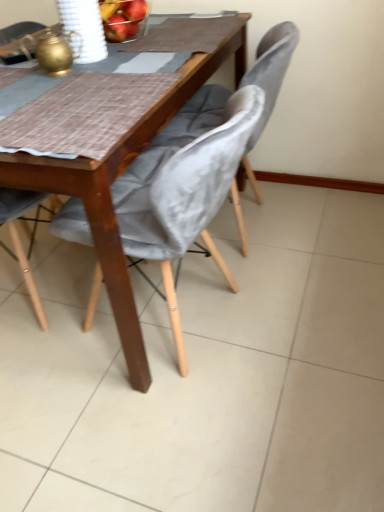
Question: Is velvet grey chair at center, the third chair from the left, further to the viewer compared to velvet grey chair at center, the second chair positioned from the left?

Choices:
 (A) yes
 (B) no

Answer: (A)

Question: Does velvet grey chair at center, the third chair from the left, appear on the left side of velvet grey chair at center, the second chair positioned from the left?

Choices:
 (A) no
 (B) yes

Answer: (A)

Question: Is velvet grey chair at center, the third chair from the left, positioned with its back to velvet grey chair at center, the second chair positioned from the left?

Choices:
 (A) yes
 (B) no

Answer: (B)

Question: Would you say velvet grey chair at center, the third chair from the left, contains velvet grey chair at center, which is the second chair in right-to-left order?

Choices:
 (A) no
 (B) yes

Answer: (A)

Question: Does velvet grey chair at center, the 1th chair in the right-to-left sequence, touch velvet grey chair at center, which is the second chair in right-to-left order?

Choices:
 (A) yes
 (B) no

Answer: (B)

Question: From a real-world perspective, is velvet grey chair at center, the 1th chair in the right-to-left sequence, on velvet grey chair at center, which is the second chair in right-to-left order?

Choices:
 (A) no
 (B) yes

Answer: (B)

Question: Does velvet grey chair at lower left, the 3th chair positioned from the right, have a lesser width compared to velvet grey chair at center, the 1th chair in the right-to-left sequence?

Choices:
 (A) yes
 (B) no

Answer: (B)

Question: Does velvet grey chair at lower left, the 3th chair positioned from the right, appear on the right side of velvet grey chair at center, the 1th chair in the right-to-left sequence?

Choices:
 (A) yes
 (B) no

Answer: (B)

Question: Does velvet grey chair at lower left, which is the 1th chair from left to right, turn towards velvet grey chair at center, the third chair from the left?

Choices:
 (A) no
 (B) yes

Answer: (A)

Question: Can you confirm if velvet grey chair at lower left, which is the 1th chair from left to right, is bigger than velvet grey chair at center, the third chair from the left?

Choices:
 (A) yes
 (B) no

Answer: (A)

Question: Is velvet grey chair at lower left, the 3th chair positioned from the right, taller than velvet grey chair at center, the 1th chair in the right-to-left sequence?

Choices:
 (A) yes
 (B) no

Answer: (A)

Question: Is velvet grey chair at lower left, the 3th chair positioned from the right, looking in the opposite direction of velvet grey chair at center, the 1th chair in the right-to-left sequence?

Choices:
 (A) yes
 (B) no

Answer: (B)

Question: Is velvet grey chair at center, the 1th chair in the right-to-left sequence, closer to the viewer compared to velvet grey chair at lower left, which is the 1th chair from left to right?

Choices:
 (A) no
 (B) yes

Answer: (A)